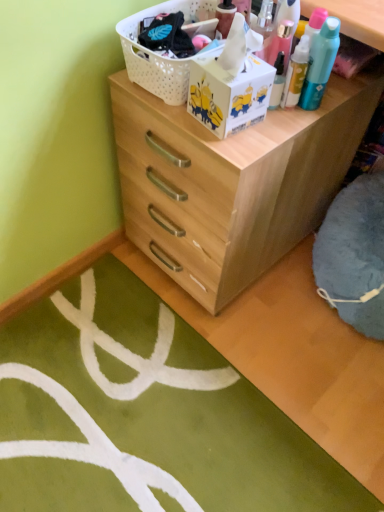
The image size is (384, 512). What are the coordinates of `white plastic basket at upper center` in the screenshot? It's located at (160, 52).

Measure the distance between point (139,74) and camera.

Point (139,74) is 35.47 inches away from camera.

The image size is (384, 512). What do you see at coordinates (160, 52) in the screenshot?
I see `white plastic basket at upper center` at bounding box center [160, 52].

Image resolution: width=384 pixels, height=512 pixels. What do you see at coordinates (232, 182) in the screenshot?
I see `natural wood chest of drawers at center` at bounding box center [232, 182].

At what (x,y) coordinates should I click in order to perform the action: click on natural wood chest of drawers at center. Please return your answer as a coordinate pair (x, y). Image resolution: width=384 pixels, height=512 pixels. Looking at the image, I should click on (232, 182).

Where is `white plastic basket at upper center`? Image resolution: width=384 pixels, height=512 pixels. white plastic basket at upper center is located at coordinates (160, 52).

Considering the positions of objects white plastic basket at upper center and natural wood chest of drawers at center in the image provided, who is more to the right, white plastic basket at upper center or natural wood chest of drawers at center?

natural wood chest of drawers at center.

Considering the positions of objects white plastic basket at upper center and natural wood chest of drawers at center in the image provided, who is in front, white plastic basket at upper center or natural wood chest of drawers at center?

Positioned in front is natural wood chest of drawers at center.

Which is closer, (171,78) or (235,260)?

Positioned in front is point (171,78).

From the image's perspective, which is above, white plastic basket at upper center or natural wood chest of drawers at center?

white plastic basket at upper center appears higher in the image.

From a real-world perspective, which object stands above the other?

From a 3D spatial view, white plastic basket at upper center is above.

Does white plastic basket at upper center have a greater width compared to natural wood chest of drawers at center?

Incorrect, the width of white plastic basket at upper center does not surpass that of natural wood chest of drawers at center.

Considering the relative sizes of white plastic basket at upper center and natural wood chest of drawers at center in the image provided, is white plastic basket at upper center shorter than natural wood chest of drawers at center?

Yes.

Which of these two, white plastic basket at upper center or natural wood chest of drawers at center, is bigger?

natural wood chest of drawers at center is bigger.

Can natural wood chest of drawers at center be found inside white plastic basket at upper center?

No, natural wood chest of drawers at center is located outside of white plastic basket at upper center.

Does white plastic basket at upper center touch natural wood chest of drawers at center?

They are not placed beside each other.

Could you tell me if white plastic basket at upper center is turned towards natural wood chest of drawers at center?

No.

Can you tell me how much white plastic basket at upper center and natural wood chest of drawers at center differ in facing direction?

90 degrees separate the facing orientations of white plastic basket at upper center and natural wood chest of drawers at center.

In the image, there is a white plastic basket at upper center. Identify the location of the chest of drawers below it (from a real-world perspective). This screenshot has height=512, width=384. (232, 182).

Is natural wood chest of drawers at center at the right side of white plastic basket at upper center?

Yes, natural wood chest of drawers at center is to the right of white plastic basket at upper center.

Which object is more forward, natural wood chest of drawers at center or white plastic basket at upper center?

natural wood chest of drawers at center is more forward.

Which point is more forward, (212, 195) or (174, 11)?

The point (174, 11) is in front.

From the image's perspective, is natural wood chest of drawers at center above or below white plastic basket at upper center?

Based on their image positions, natural wood chest of drawers at center is located beneath white plastic basket at upper center.

From a real-world perspective, which is physically below, natural wood chest of drawers at center or white plastic basket at upper center?

From a 3D spatial view, natural wood chest of drawers at center is below.

Between natural wood chest of drawers at center and white plastic basket at upper center, which one has smaller width?

white plastic basket at upper center is thinner.

In terms of height, does natural wood chest of drawers at center look taller or shorter compared to white plastic basket at upper center?

natural wood chest of drawers at center is taller than white plastic basket at upper center.

Can you confirm if natural wood chest of drawers at center is bigger than white plastic basket at upper center?

Yes, natural wood chest of drawers at center is bigger than white plastic basket at upper center.

Could white plastic basket at upper center be considered to be inside natural wood chest of drawers at center?

No.

Is natural wood chest of drawers at center far away from white plastic basket at upper center?

natural wood chest of drawers at center is near white plastic basket at upper center, not far away.

Is natural wood chest of drawers at center facing towards white plastic basket at upper center?

No.

How many degrees apart are the facing directions of natural wood chest of drawers at center and white plastic basket at upper center?

There is a 90-degree angle between the facing directions of natural wood chest of drawers at center and white plastic basket at upper center.

This screenshot has height=512, width=384. In order to click on the chest of drawers lying below the white plastic basket at upper center (from the image's perspective) in this screenshot , I will do `click(232, 182)`.

Locate an element on the screen. This screenshot has height=512, width=384. basket lying on the left of natural wood chest of drawers at center is located at coordinates (160, 52).

The width and height of the screenshot is (384, 512). Identify the location of basket above the natural wood chest of drawers at center (from the image's perspective). (160, 52).